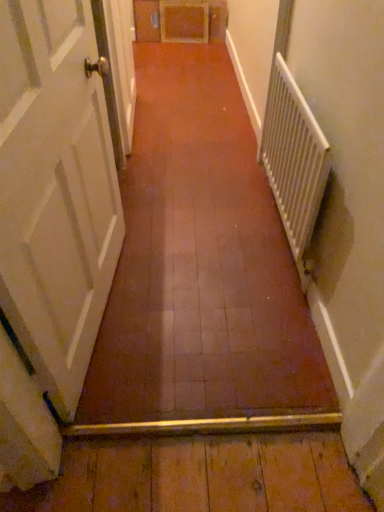
Question: Is white metallic radiator at right smaller than white painted wood door at left?

Choices:
 (A) no
 (B) yes

Answer: (B)

Question: Is white metallic radiator at right further to the viewer compared to white painted wood door at left?

Choices:
 (A) yes
 (B) no

Answer: (A)

Question: From a real-world perspective, is white metallic radiator at right physically below white painted wood door at left?

Choices:
 (A) yes
 (B) no

Answer: (A)

Question: From a real-world perspective, is white metallic radiator at right positioned over white painted wood door at left based on gravity?

Choices:
 (A) yes
 (B) no

Answer: (B)

Question: Considering the relative sizes of white metallic radiator at right and white painted wood door at left in the image provided, is white metallic radiator at right wider than white painted wood door at left?

Choices:
 (A) no
 (B) yes

Answer: (A)

Question: Can you confirm if white metallic radiator at right is shorter than white painted wood door at left?

Choices:
 (A) yes
 (B) no

Answer: (A)

Question: Would you say white painted wood door at left is outside white metallic radiator at right?

Choices:
 (A) no
 (B) yes

Answer: (B)

Question: From the image's perspective, does white painted wood door at left appear lower than white metallic radiator at right?

Choices:
 (A) yes
 (B) no

Answer: (A)

Question: Does white painted wood door at left have a larger size compared to white metallic radiator at right?

Choices:
 (A) no
 (B) yes

Answer: (B)

Question: Could you tell me if white painted wood door at left is turned towards white metallic radiator at right?

Choices:
 (A) no
 (B) yes

Answer: (B)

Question: Is white painted wood door at left with white metallic radiator at right?

Choices:
 (A) no
 (B) yes

Answer: (A)

Question: Is white painted wood door at left facing away from white metallic radiator at right?

Choices:
 (A) no
 (B) yes

Answer: (A)

Question: From the image's perspective, is white metallic radiator at right above or below white painted wood door at left?

Choices:
 (A) below
 (B) above

Answer: (B)